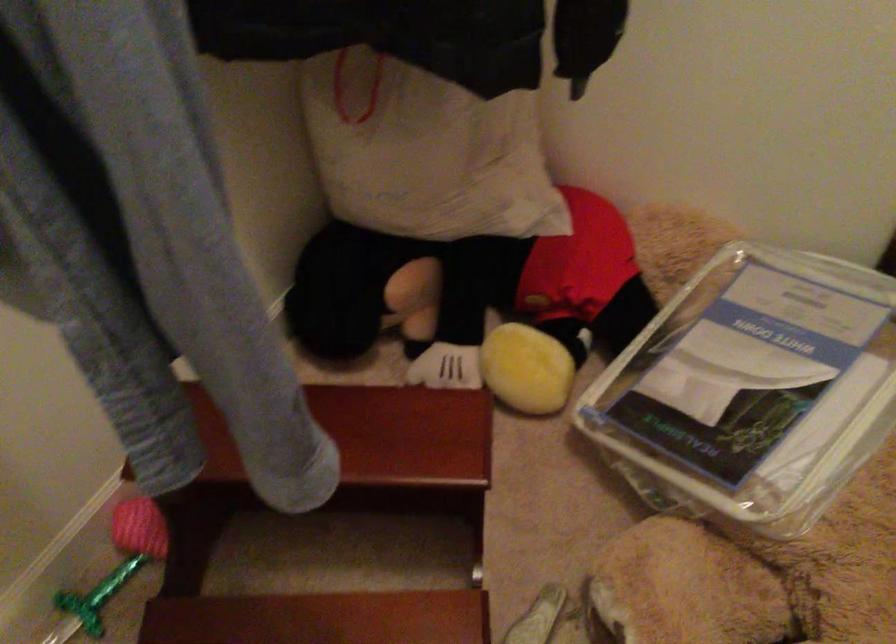
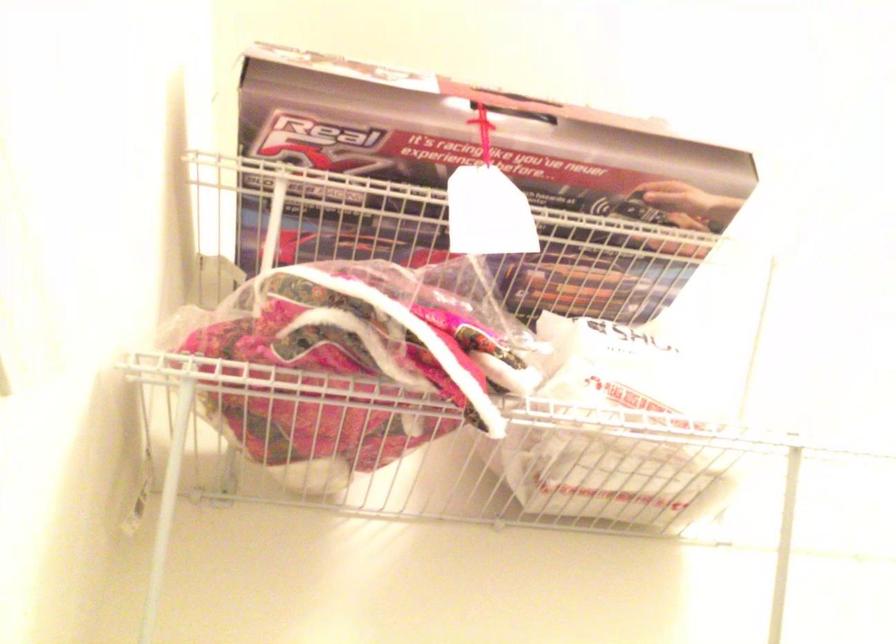
First-person continuous shooting, in which direction is the camera rotating?

The camera's rotation is toward left-up.